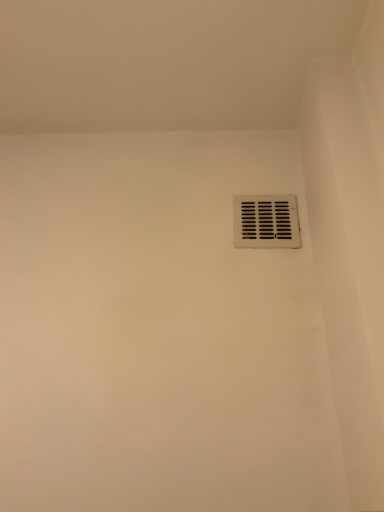
The image size is (384, 512). Find the location of `white matte vent at center`. white matte vent at center is located at coordinates coord(266,222).

The height and width of the screenshot is (512, 384). What do you see at coordinates (266, 222) in the screenshot? I see `white matte vent at center` at bounding box center [266, 222].

This screenshot has height=512, width=384. Find the location of `white matte vent at center`. white matte vent at center is located at coordinates (266, 222).